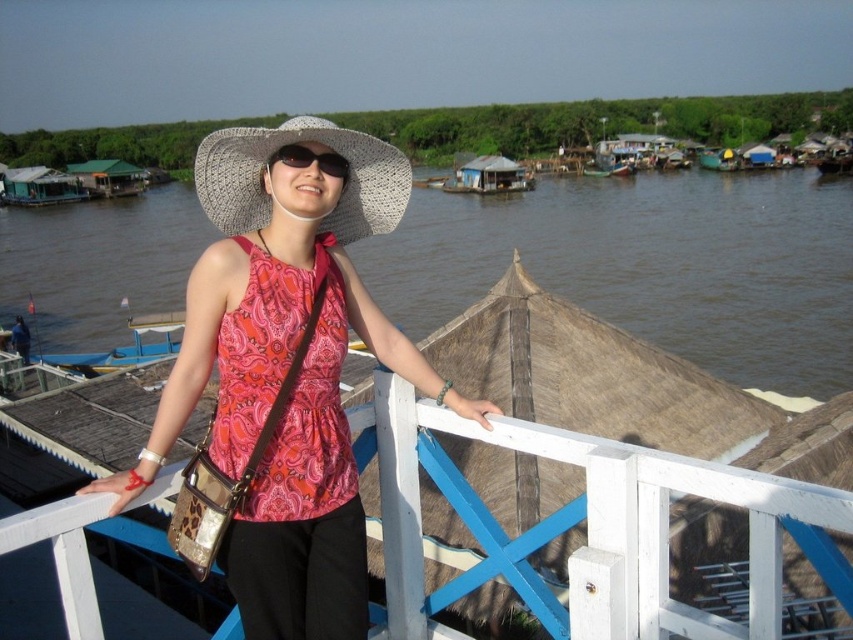
Question: Is blue wooden boat at left smaller than wooden houseboat at left?

Choices:
 (A) yes
 (B) no

Answer: (A)

Question: Which object appears closest to the camera in this image?

Choices:
 (A) wooden houseboat at left
 (B) brown wooden boat at center

Answer: (B)

Question: Is wooden houseboat at left closer to the viewer compared to wooden thatched roof houseboat at center?

Choices:
 (A) no
 (B) yes

Answer: (A)

Question: Is white woven straw hat at center further to camera compared to black plastic sunglasses at center?

Choices:
 (A) no
 (B) yes

Answer: (A)

Question: Which is farther from the wooden thatched roof houseboat at center?

Choices:
 (A) white woven straw hat at center
 (B) black plastic sunglasses at center

Answer: (B)

Question: Which point appears closest to the camera in this image?

Choices:
 (A) (329, 154)
 (B) (39, 195)
 (C) (459, 189)
 (D) (357, 220)

Answer: (A)